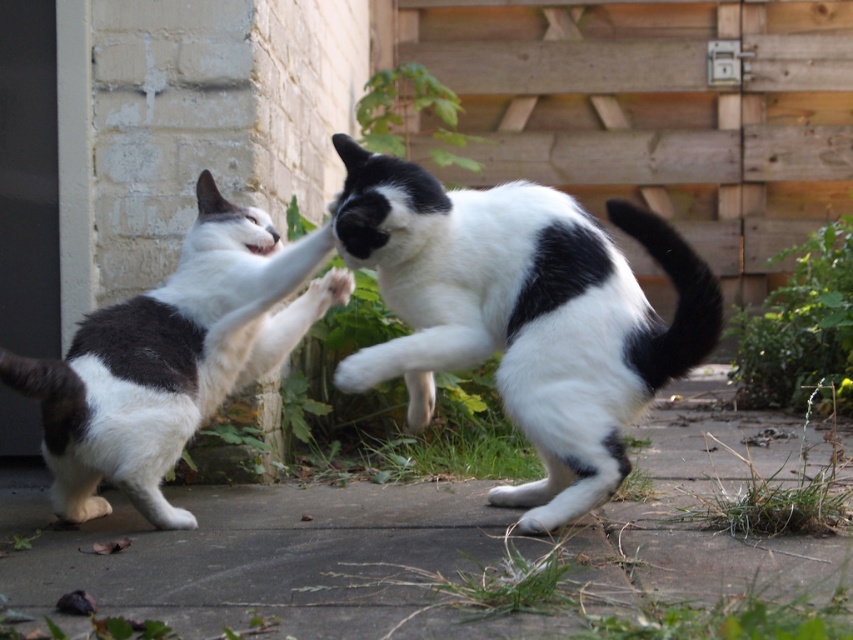
You are a cat owner trying to decide which cat to adopt. Both cats are in the image. The black and white fur cat at center is much taller than the white fur cat at left. Which cat is taller?

The black and white fur cat at center is taller than the white fur cat at left.

You are a photographer trying to capture the cats in the scene. You want to ensure both cats are in focus. Since the black and white fur cat at center is larger, does that mean it is closer to you than the white fur cat at left?

Yes, the black and white fur cat at center is bigger than the white fur cat at left, so it is closer to you.